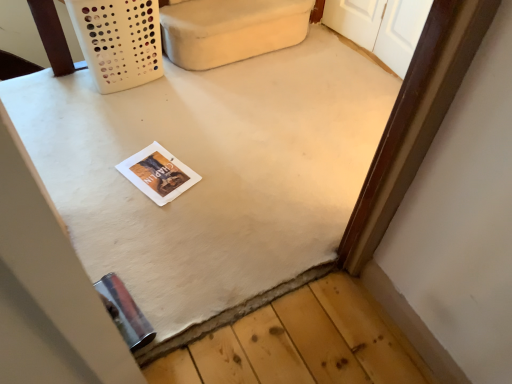
Question: Is white fabric couch at upper center inside or outside of white matte table at center?

Choices:
 (A) inside
 (B) outside

Answer: (B)

Question: In the image, is white fabric couch at upper center on the left side or the right side of white matte table at center?

Choices:
 (A) right
 (B) left

Answer: (A)

Question: Estimate the real-world distances between objects in this image. Which object is farther from the white paper magazine at center?

Choices:
 (A) white matte table at center
 (B) white fabric couch at upper center

Answer: (B)

Question: Which object is positioned farthest from the white matte table at center?

Choices:
 (A) white paper magazine at center
 (B) white fabric couch at upper center

Answer: (B)